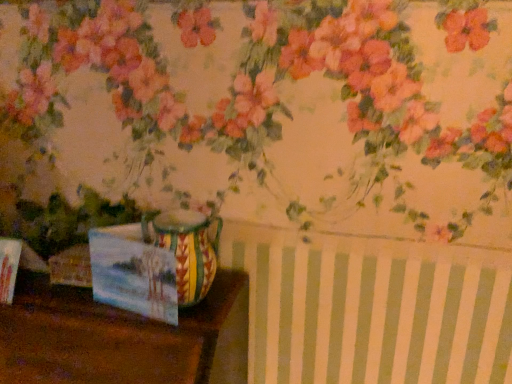
Question: Is matte paper postcard at lower left taller or shorter than wooden table at lower left?

Choices:
 (A) tall
 (B) short

Answer: (B)

Question: From a real-world perspective, is matte paper postcard at lower left physically located above or below wooden table at lower left?

Choices:
 (A) above
 (B) below

Answer: (A)

Question: Estimate the real-world distances between objects in this image. Which object is closer to the multicolored ceramic vase at center?

Choices:
 (A) wooden table at lower left
 (B) matte paper postcard at lower left

Answer: (B)

Question: Which is nearer to the wooden table at lower left?

Choices:
 (A) multicolored ceramic vase at center
 (B) matte paper postcard at lower left

Answer: (B)